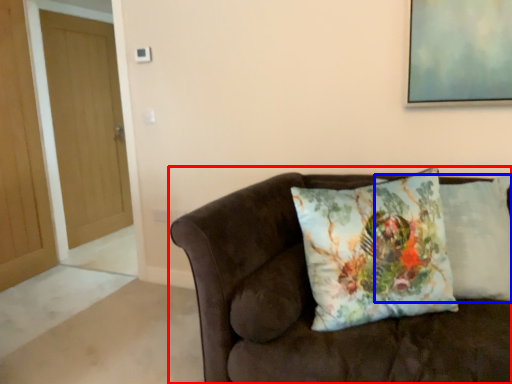
Question: Which object is closer to the camera taking this photo, studio couch (highlighted by a red box) or pillow (highlighted by a blue box)?

Choices:
 (A) studio couch
 (B) pillow

Answer: (A)